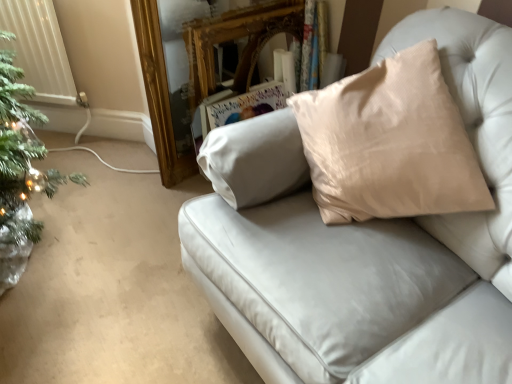
Question: Can you confirm if satin beige pillow at upper right is shorter than gold ornate mirror at upper center?

Choices:
 (A) yes
 (B) no

Answer: (B)

Question: Considering the relative sizes of satin beige pillow at upper right and gold ornate mirror at upper center in the image provided, is satin beige pillow at upper right smaller than gold ornate mirror at upper center?

Choices:
 (A) no
 (B) yes

Answer: (A)

Question: Does satin beige pillow at upper right lie behind gold ornate mirror at upper center?

Choices:
 (A) yes
 (B) no

Answer: (B)

Question: Is satin beige pillow at upper right aimed at gold ornate mirror at upper center?

Choices:
 (A) no
 (B) yes

Answer: (A)

Question: Can gold ornate mirror at upper center be found inside satin beige pillow at upper right?

Choices:
 (A) no
 (B) yes

Answer: (A)

Question: From the image's perspective, is gold ornate mirror at upper center located above or below white plastic radiator at left?

Choices:
 (A) above
 (B) below

Answer: (B)

Question: Would you say gold ornate mirror at upper center is to the left or to the right of white plastic radiator at left in the picture?

Choices:
 (A) right
 (B) left

Answer: (A)

Question: Does point (280, 6) appear closer or farther from the camera than point (18, 57)?

Choices:
 (A) closer
 (B) farther

Answer: (A)

Question: Is gold ornate mirror at upper center inside the boundaries of white plastic radiator at left, or outside?

Choices:
 (A) inside
 (B) outside

Answer: (B)

Question: From a real-world perspective, is satin beige pillow at upper right physically located above or below white plastic radiator at left?

Choices:
 (A) above
 (B) below

Answer: (A)

Question: Considering the positions of satin beige pillow at upper right and white plastic radiator at left in the image, is satin beige pillow at upper right taller or shorter than white plastic radiator at left?

Choices:
 (A) tall
 (B) short

Answer: (A)

Question: Relative to white plastic radiator at left, is satin beige pillow at upper right in front or behind?

Choices:
 (A) behind
 (B) front

Answer: (B)

Question: Is satin beige pillow at upper right to the left or to the right of white plastic radiator at left in the image?

Choices:
 (A) right
 (B) left

Answer: (A)

Question: Is satin beige pillow at upper right wider or thinner than gold ornate mirror at upper center?

Choices:
 (A) wide
 (B) thin

Answer: (A)

Question: From a real-world perspective, relative to gold ornate mirror at upper center, is satin beige pillow at upper right vertically above or below?

Choices:
 (A) above
 (B) below

Answer: (A)